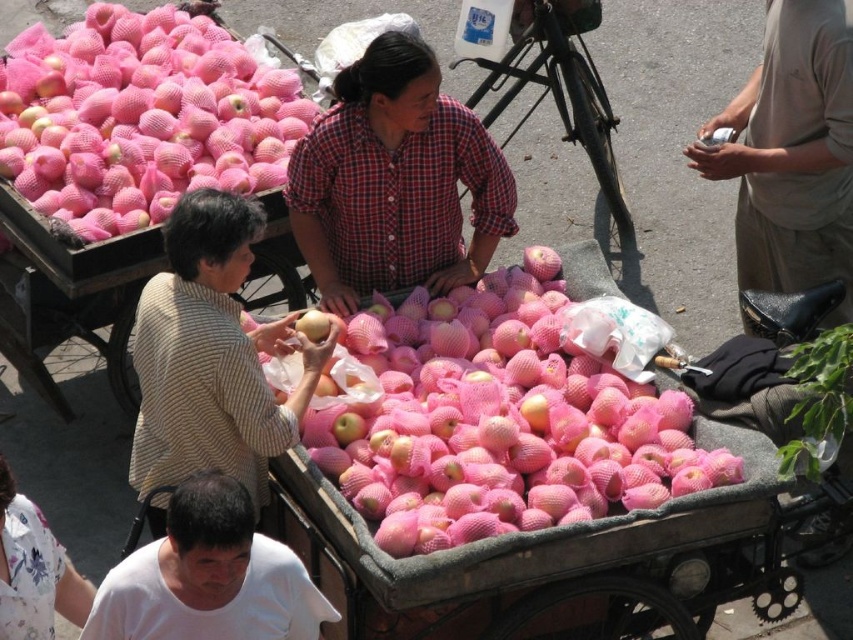
Looking at this image, you are a customer at the market and want to buy an apple. You see the pink mesh bagged apples at upper left and the matte yellow apple at center. Which one is bigger?

The pink mesh bagged apples at upper left are larger in size compared to the matte yellow apple at center.